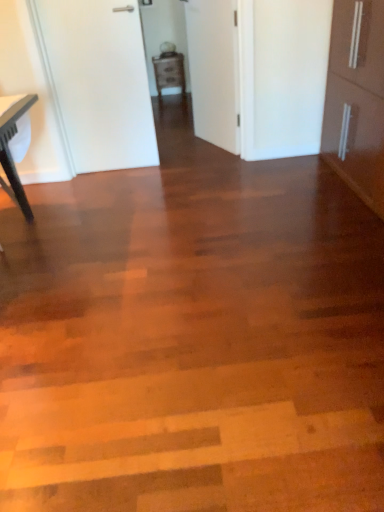
I want to click on vacant region below matte black table at left (from a real-world perspective), so click(10, 230).